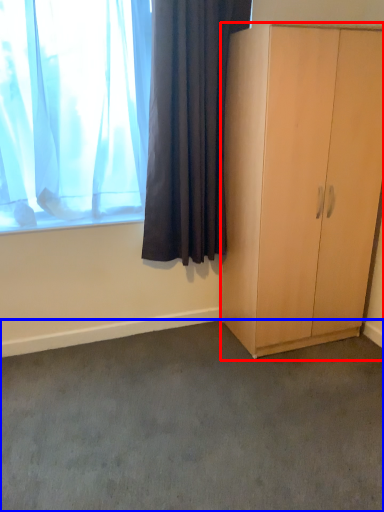
Question: Which object appears closest to the camera in this image, cabinetry (highlighted by a red box) or plain (highlighted by a blue box)?

Choices:
 (A) cabinetry
 (B) plain

Answer: (B)